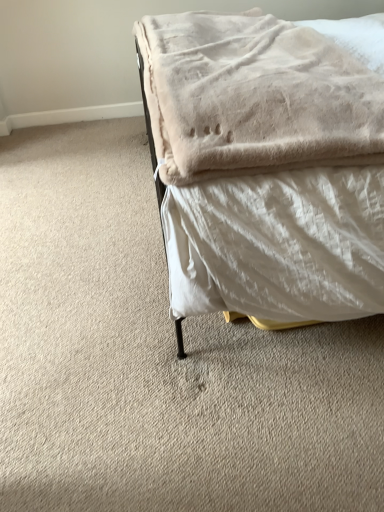
What do you see at coordinates (261, 92) in the screenshot?
I see `beige plush blanket at center` at bounding box center [261, 92].

In order to click on beige plush blanket at center in this screenshot , I will do `click(261, 92)`.

What is the approximate height of beige plush blanket at center?

The height of beige plush blanket at center is 5.66 inches.

The width and height of the screenshot is (384, 512). Identify the location of beige plush blanket at center. (261, 92).